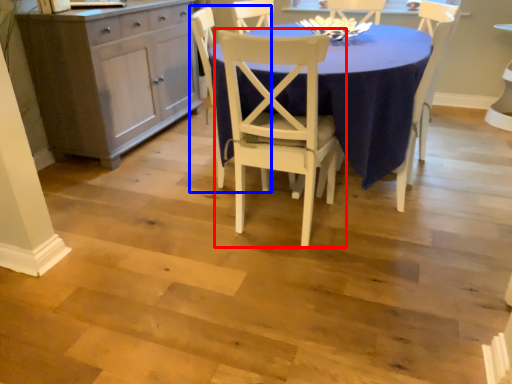
Question: Among these objects, which one is nearest to the camera, chair (highlighted by a red box) or chair (highlighted by a blue box)?

Choices:
 (A) chair
 (B) chair

Answer: (A)